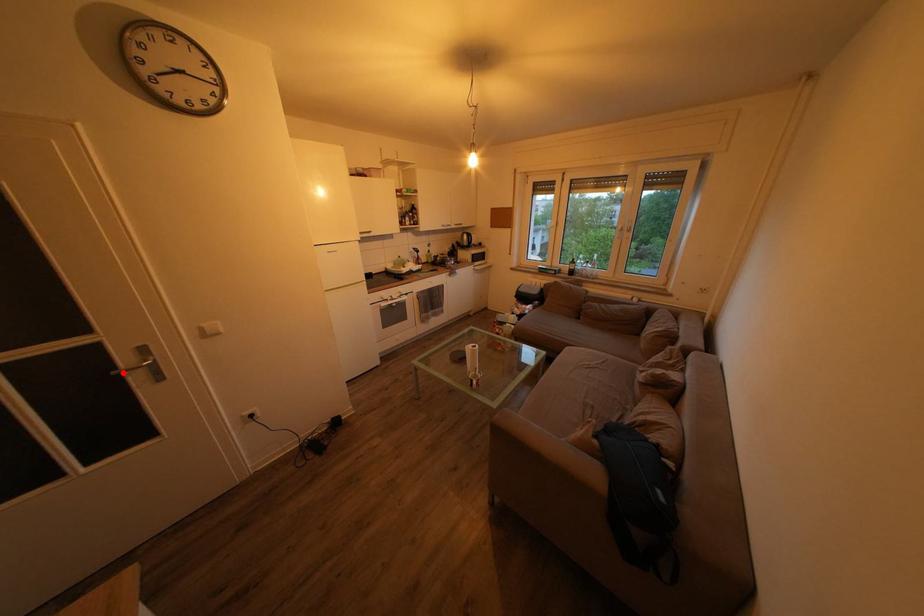
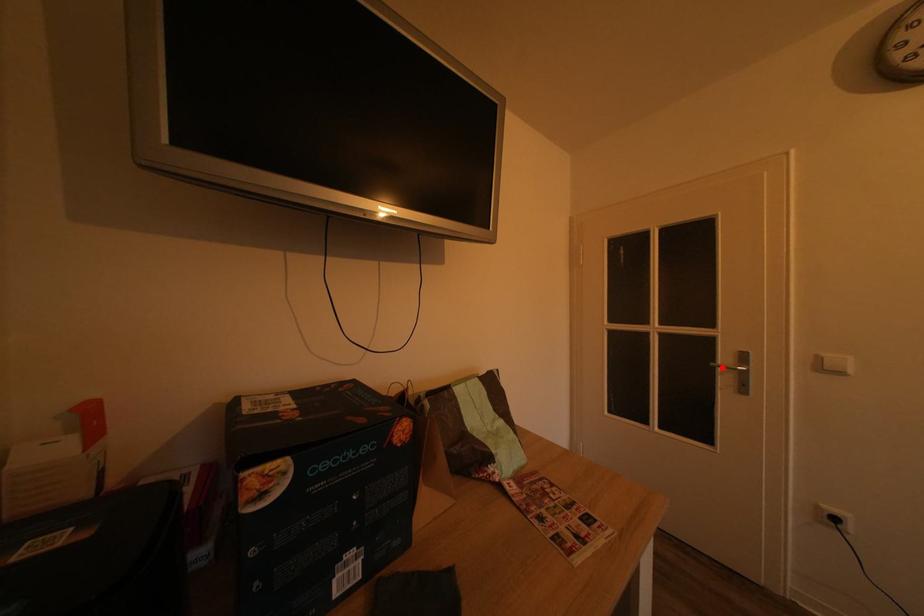
I am providing you with two images of the same scene from different viewpoints. A red point is marked on the first image and another point is marked on the second image. Does the point marked in image1 correspond to the same location as the one in image2?

Yes